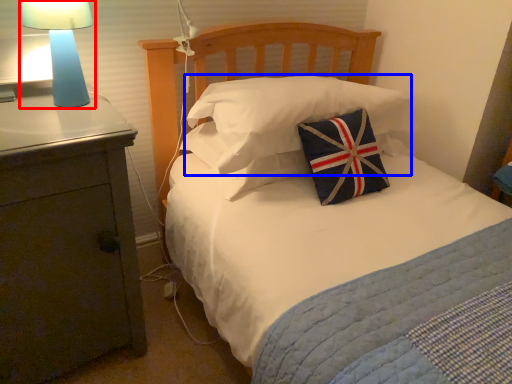
Question: Which object is closer to the camera taking this photo, lamp (highlighted by a red box) or pillow (highlighted by a blue box)?

Choices:
 (A) lamp
 (B) pillow

Answer: (A)